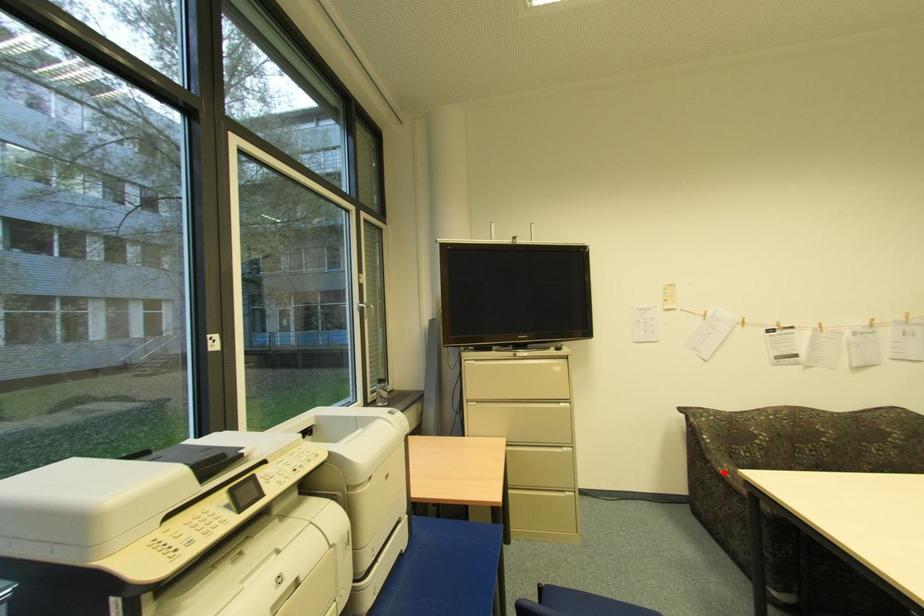
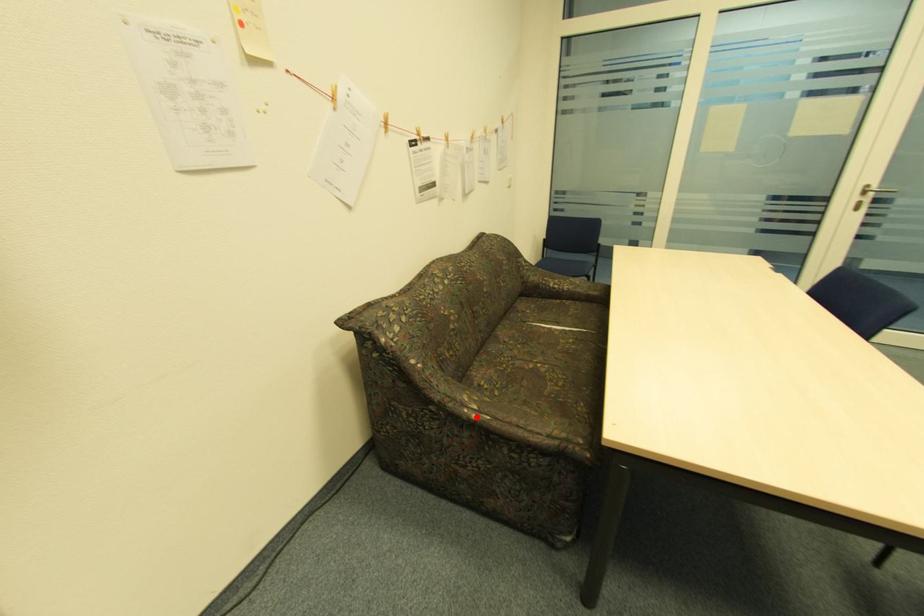
I am providing you with two images of the same scene from different viewpoints. A red point is marked on the first image and another point is marked on the second image. Does the point marked in image1 correspond to the same location as the one in image2?

Yes